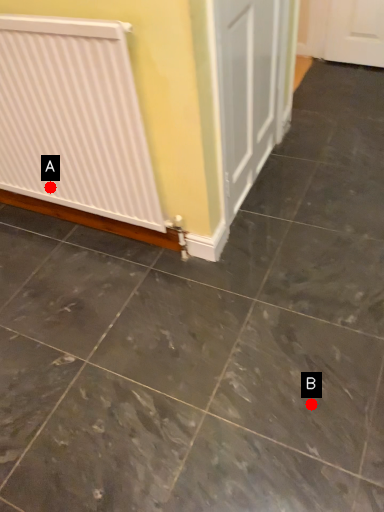
Question: Two points are circled on the image, labeled by A and B beside each circle. Which point is closer to the camera?

Choices:
 (A) A is closer
 (B) B is closer

Answer: (B)